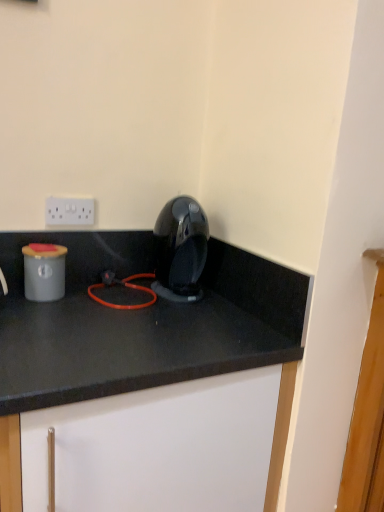
You are a GUI agent. You are given a task and a screenshot of the screen. Output one action in this format:
    pyautogui.click(x=<x>, y=<y>)
    Task: Click on the free point above white matte cabinet at center (from a real-world perspective)
    The width and height of the screenshot is (384, 512).
    Given the screenshot: What is the action you would take?
    pyautogui.click(x=128, y=311)